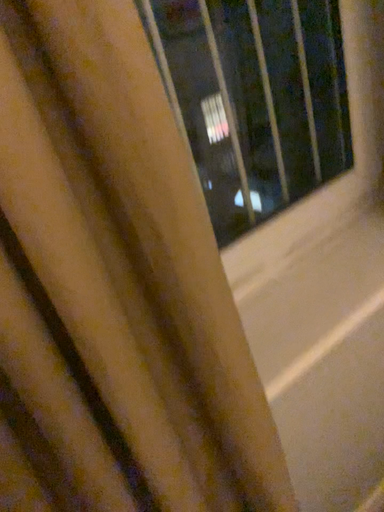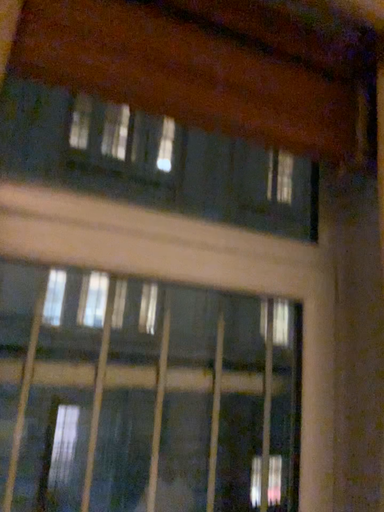
Question: Which way did the camera rotate in the video?

Choices:
 (A) rotated downward
 (B) rotated upward

Answer: (B)